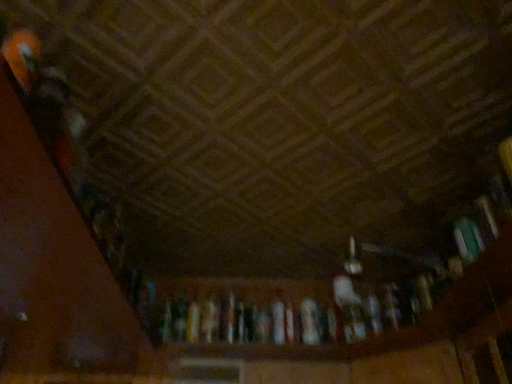
Question: Which direction should I rotate to look at white paper book at center, the 2th book in the top-to-bottom sequence, — up or down?

Choices:
 (A) up
 (B) down

Answer: (B)

Question: Considering the relative positions of teal matte book at right, which appears as the 1th book when viewed from the top, and white paper book at center, which is counted as the second book, starting from the front, in the image provided, is teal matte book at right, which appears as the 1th book when viewed from the top, in front of white paper book at center, which is counted as the second book, starting from the front,?

Choices:
 (A) yes
 (B) no

Answer: (A)

Question: Does teal matte book at right, which appears as the 1th book when viewed from the top, appear on the left side of white paper book at center, the first book viewed from the left?

Choices:
 (A) yes
 (B) no

Answer: (B)

Question: Considering the relative positions of teal matte book at right, the 2th book in the left-to-right sequence, and white paper book at center, the first book viewed from the left, in the image provided, is teal matte book at right, the 2th book in the left-to-right sequence, to the right of white paper book at center, the first book viewed from the left, from the viewer's perspective?

Choices:
 (A) no
 (B) yes

Answer: (B)

Question: From a real-world perspective, is teal matte book at right, which is the second book in bottom-to-top order, over white paper book at center, the first book viewed from the left?

Choices:
 (A) yes
 (B) no

Answer: (A)

Question: Considering the relative sizes of teal matte book at right, the 2th book in the left-to-right sequence, and white paper book at center, the first book viewed from the left, in the image provided, is teal matte book at right, the 2th book in the left-to-right sequence, smaller than white paper book at center, the first book viewed from the left,?

Choices:
 (A) no
 (B) yes

Answer: (A)

Question: From a real-world perspective, is teal matte book at right, which is counted as the 1th book, starting from the right, below white paper book at center, the first book viewed from the left?

Choices:
 (A) yes
 (B) no

Answer: (B)

Question: Does white paper book at center, the first book viewed from the left, come behind teal matte book at right, which appears as the 1th book when viewed from the front?

Choices:
 (A) no
 (B) yes

Answer: (B)

Question: Does white paper book at center, arranged as the first book when ordered from the bottom, have a greater width compared to teal matte book at right, which is counted as the 1th book, starting from the right?

Choices:
 (A) no
 (B) yes

Answer: (A)

Question: Is teal matte book at right, which appears as the 1th book when viewed from the front, a part of white paper book at center, the first book viewed from the left?

Choices:
 (A) yes
 (B) no

Answer: (B)

Question: From the image's perspective, would you say white paper book at center, which is counted as the second book, starting from the front, is positioned over teal matte book at right, the 2th book in the left-to-right sequence?

Choices:
 (A) no
 (B) yes

Answer: (A)

Question: Is white paper book at center, which is counted as the second book, starting from the front, at the left side of teal matte book at right, which appears as the 1th book when viewed from the top?

Choices:
 (A) yes
 (B) no

Answer: (A)

Question: Is there a large distance between white paper book at center, the 2th book in the top-to-bottom sequence, and teal matte book at right, which appears as the 1th book when viewed from the front?

Choices:
 (A) no
 (B) yes

Answer: (A)

Question: From a real-world perspective, is white paper book at center, which is counted as the 1th book, starting from the back, above or below teal matte book at right, which is the second book in bottom-to-top order?

Choices:
 (A) below
 (B) above

Answer: (A)